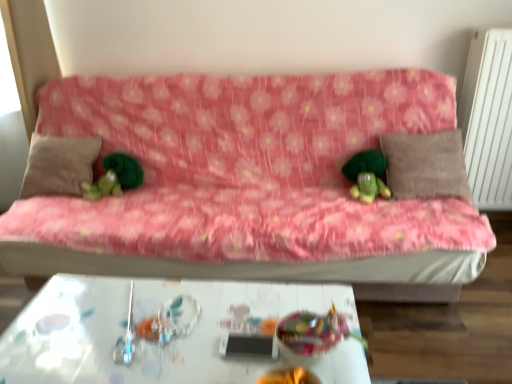
At what (x,y) coordinates should I click in order to perform the action: click on free point behind translucent plastic bowl at center, arranged as the second toy when viewed from the back. Please return your answer as a coordinate pair (x, y). This screenshot has width=512, height=384. Looking at the image, I should click on (285, 299).